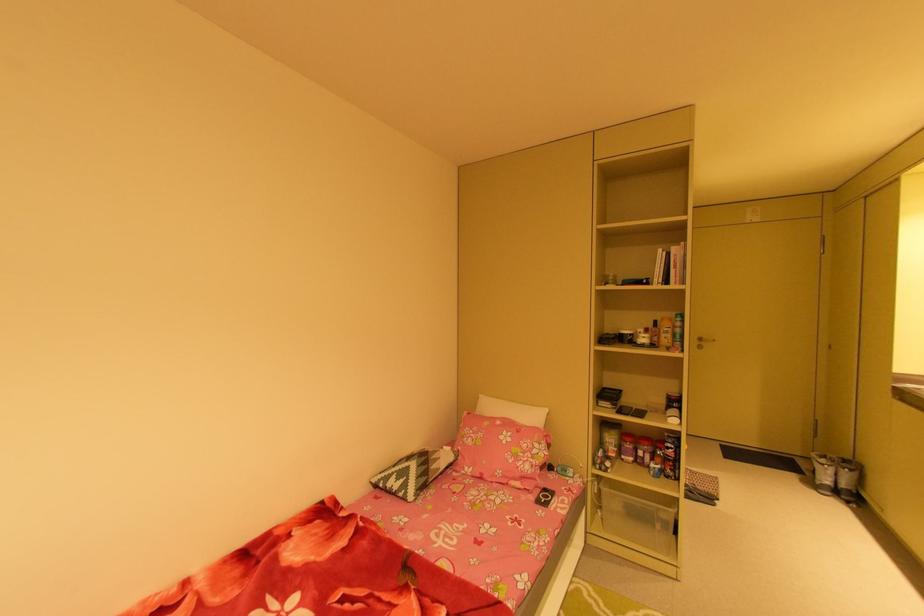
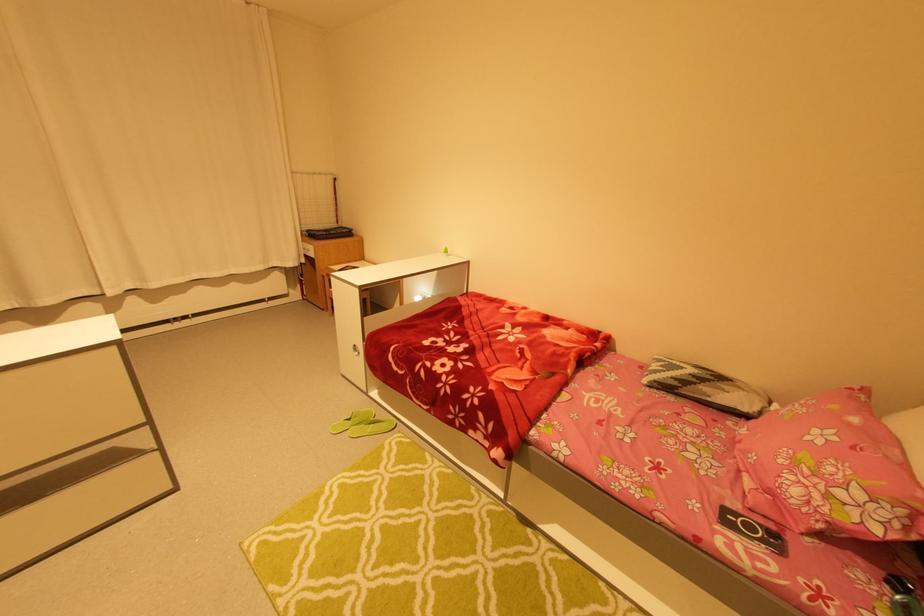
The point at (x=550, y=490) is marked in the first image. Where is the corresponding point in the second image?

(781, 536)